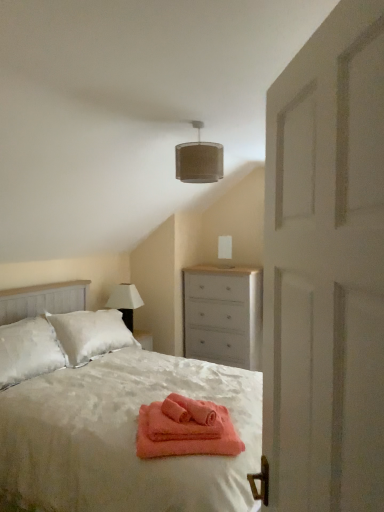
The width and height of the screenshot is (384, 512). Find the location of `white satin bed at center`. white satin bed at center is located at coordinates (112, 416).

The width and height of the screenshot is (384, 512). What do you see at coordinates (112, 416) in the screenshot? I see `white satin bed at center` at bounding box center [112, 416].

What is the approximate width of white painted wood chest of drawers at center?

white painted wood chest of drawers at center is 19.95 inches wide.

Locate an element on the screen. white wooden door at right is located at coordinates (326, 268).

Find the location of a particular element. This screenshot has width=384, height=512. white fabric lampshade at upper left is located at coordinates (125, 302).

From the image's perspective, which is below, white fabric lampshade at upper left or white satin bed at center?

From the image's view, white satin bed at center is below.

Is white fabric lampshade at upper left next to white satin bed at center?

No, white fabric lampshade at upper left is not making contact with white satin bed at center.

Looking at their sizes, would you say white fabric lampshade at upper left is wider or thinner than white satin bed at center?

In the image, white fabric lampshade at upper left appears to be more narrow than white satin bed at center.

Would you say white satin bed at center contains white fabric lampshade at upper left?

No, white fabric lampshade at upper left is located outside of white satin bed at center.

From the image's perspective, which is below, white satin bed at center or white fabric lampshade at upper left?

white satin bed at center appears lower in the image.

Between white satin bed at center and white fabric lampshade at upper left, which one appears on the right side from the viewer's perspective?

white satin bed at center.

Considering the sizes of objects white satin bed at center and white fabric lampshade at upper left in the image provided, who is shorter, white satin bed at center or white fabric lampshade at upper left?

white fabric lampshade at upper left.

Based on the photo, considering the sizes of objects white fabric lampshade at upper left and beige fabric lampshade at upper center in the image provided, who is smaller, white fabric lampshade at upper left or beige fabric lampshade at upper center?

beige fabric lampshade at upper center.

Is white fabric lampshade at upper left looking in the opposite direction of beige fabric lampshade at upper center?

No, white fabric lampshade at upper left is not facing away from beige fabric lampshade at upper center.

Would you say white fabric lampshade at upper left is a long distance from beige fabric lampshade at upper center?

Yes, white fabric lampshade at upper left and beige fabric lampshade at upper center are quite far apart.

Is white fabric lampshade at upper left positioned behind beige fabric lampshade at upper center?

Yes, white fabric lampshade at upper left is further from the camera.

Considering the positions of objects beige fabric lampshade at upper center and white wooden door at right in the image provided, who is more to the left, beige fabric lampshade at upper center or white wooden door at right?

beige fabric lampshade at upper center.

Considering the points (208, 158) and (301, 492), which point is in front, point (208, 158) or point (301, 492)?

The point (301, 492) is closer.

Is beige fabric lampshade at upper center spatially inside white wooden door at right, or outside of it?

beige fabric lampshade at upper center exists outside the volume of white wooden door at right.

Who is shorter, beige fabric lampshade at upper center or white wooden door at right?

Standing shorter between the two is beige fabric lampshade at upper center.

How different are the orientations of beige fabric lampshade at upper center and white satin bed at center in degrees?

The angle between the facing direction of beige fabric lampshade at upper center and the facing direction of white satin bed at center is 180 degrees.

Does beige fabric lampshade at upper center have a lesser height compared to white satin bed at center?

Indeed, beige fabric lampshade at upper center has a lesser height compared to white satin bed at center.

Consider the image. Considering the sizes of objects beige fabric lampshade at upper center and white satin bed at center in the image provided, who is bigger, beige fabric lampshade at upper center or white satin bed at center?

white satin bed at center is bigger.

Does beige fabric lampshade at upper center have a lesser width compared to white satin bed at center?

Correct, the width of beige fabric lampshade at upper center is less than that of white satin bed at center.

Does white painted wood chest of drawers at center turn towards white fabric lampshade at upper left?

No, white painted wood chest of drawers at center does not turn towards white fabric lampshade at upper left.

How many degrees apart are the facing directions of white painted wood chest of drawers at center and white fabric lampshade at upper left?

white painted wood chest of drawers at center and white fabric lampshade at upper left are facing 90 degrees away from each other.

Between white painted wood chest of drawers at center and white fabric lampshade at upper left, which one is positioned behind?

white painted wood chest of drawers at center.

Considering the sizes of objects white satin bed at center and white wooden door at right in the image provided, who is wider, white satin bed at center or white wooden door at right?

white satin bed at center is wider.

Does white satin bed at center turn towards white wooden door at right?

No, white satin bed at center does not turn towards white wooden door at right.

Would you say white satin bed at center contains white wooden door at right?

Definitely not — white wooden door at right is not inside white satin bed at center.

Considering the sizes of objects white satin bed at center and white wooden door at right in the image provided, who is bigger, white satin bed at center or white wooden door at right?

white satin bed at center.

This screenshot has height=512, width=384. What are the coordinates of `bed below the white fabric lampshade at upper left (from a real-world perspective)` in the screenshot? It's located at (112, 416).

Locate an element on the screen. Image resolution: width=384 pixels, height=512 pixels. table lamp that is above the white satin bed at center (from the image's perspective) is located at coordinates (125, 302).

Which object lies further to the anchor point white wooden door at right, white satin bed at center or beige fabric lampshade at upper center?

beige fabric lampshade at upper center is positioned further to the anchor white wooden door at right.

Based on the photo, when comparing their distances from white painted wood chest of drawers at center, does white fabric lampshade at upper left or white satin bed at center seem further?

white satin bed at center.

Estimate the real-world distances between objects in this image. Which object is closer to white painted wood chest of drawers at center, white satin bed at center or white fabric lampshade at upper left?

Among the two, white fabric lampshade at upper left is located nearer to white painted wood chest of drawers at center.

Looking at the image, which one is located closer to white satin bed at center, white fabric lampshade at upper left or white painted wood chest of drawers at center?

The object closer to white satin bed at center is white painted wood chest of drawers at center.

Considering their positions, is white fabric lampshade at upper left positioned closer to beige fabric lampshade at upper center than white painted wood chest of drawers at center?

white painted wood chest of drawers at center is positioned closer to the anchor beige fabric lampshade at upper center.

Which object lies further to the anchor point white wooden door at right, beige fabric lampshade at upper center or white painted wood chest of drawers at center?

white painted wood chest of drawers at center is further to white wooden door at right.

Considering their positions, is white painted wood chest of drawers at center positioned closer to white wooden door at right than white fabric lampshade at upper left?

white painted wood chest of drawers at center is positioned closer to the anchor white wooden door at right.

Looking at the image, which one is located closer to white painted wood chest of drawers at center, white wooden door at right or white satin bed at center?

white satin bed at center is positioned closer to the anchor white painted wood chest of drawers at center.

Identify the location of lamp located between white wooden door at right and white fabric lampshade at upper left in the depth direction. (199, 160).

I want to click on table lamp positioned between white wooden door at right and white painted wood chest of drawers at center from near to far, so click(x=125, y=302).

At what (x,y) coordinates should I click in order to perform the action: click on table lamp located between white satin bed at center and white painted wood chest of drawers at center in the depth direction. Please return your answer as a coordinate pair (x, y). Image resolution: width=384 pixels, height=512 pixels. Looking at the image, I should click on (125, 302).

At what (x,y) coordinates should I click in order to perform the action: click on lamp positioned between white satin bed at center and white fabric lampshade at upper left from near to far. Please return your answer as a coordinate pair (x, y). The width and height of the screenshot is (384, 512). Looking at the image, I should click on (199, 160).